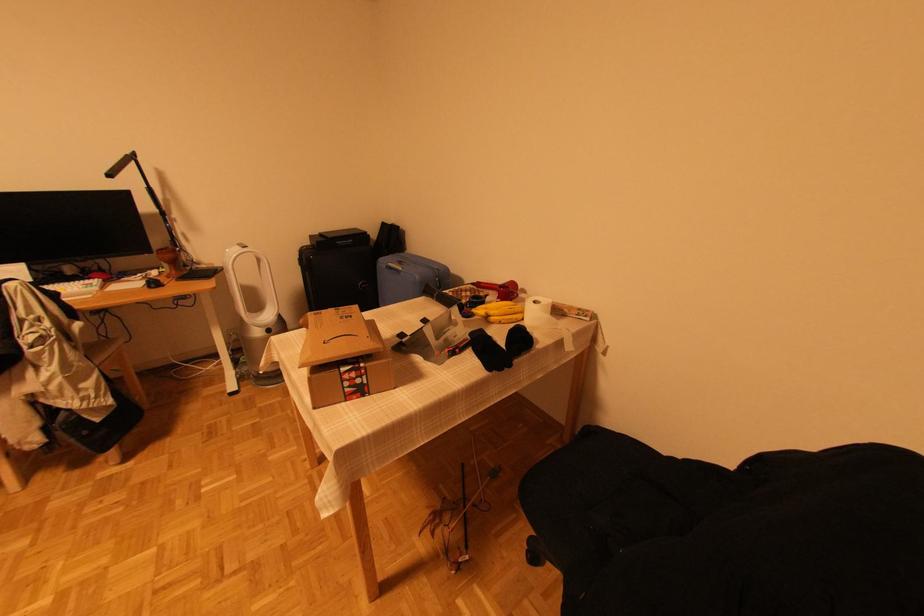
This screenshot has width=924, height=616. Describe the element at coordinates (407, 277) in the screenshot. I see `the blue suitcase handle` at that location.